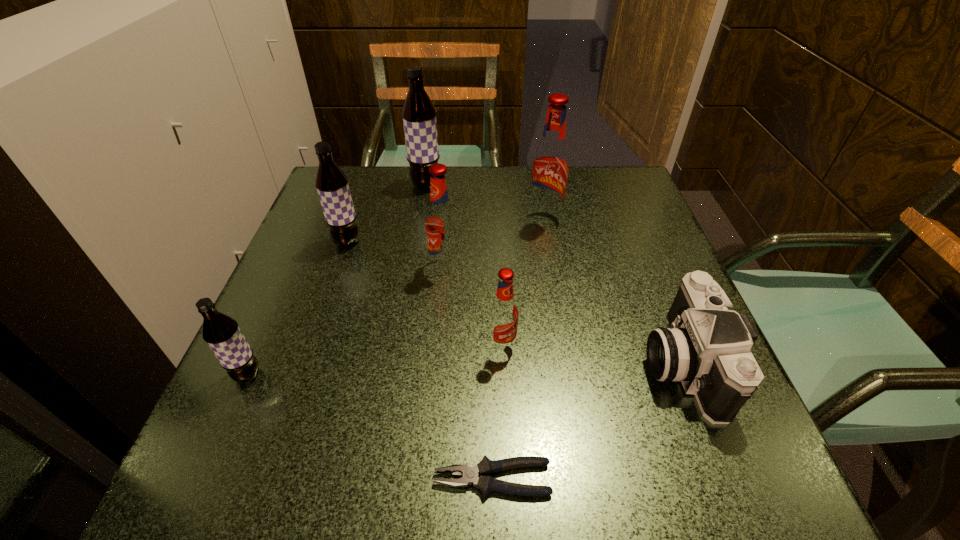
Locate an element on the screen. Image resolution: width=960 pixels, height=540 pixels. the biggest red root beer is located at coordinates (550, 166).

This screenshot has height=540, width=960. Identify the location of the farthest red root beer. (550, 166).

Identify the location of the farthest root beer. (419, 114).

Find the location of `the rightmost brown root beer`. the rightmost brown root beer is located at coordinates (419, 114).

You are a GUI agent. You are given a task and a screenshot of the screen. Output one action in this format:
    pyautogui.click(x=<x>, y=<y>)
    Task: Click on the fourth farthest root beer
    The image size is (960, 540).
    Given the screenshot: What is the action you would take?
    pyautogui.click(x=441, y=221)

Where is `the leftmost red root beer`? This screenshot has height=540, width=960. the leftmost red root beer is located at coordinates (441, 221).

Image resolution: width=960 pixels, height=540 pixels. Find the location of `the second root beer from left to right`. the second root beer from left to right is located at coordinates (332, 186).

Identify the location of the second brown root beer from left to right. This screenshot has width=960, height=540. (332, 186).

You are a GUI agent. You are given a task and a screenshot of the screen. Output one action in this format:
    pyautogui.click(x=<x>, y=<y>)
    Task: Click on the second red root beer from right to left
    Image resolution: width=960 pixels, height=540 pixels.
    Given the screenshot: What is the action you would take?
    pyautogui.click(x=503, y=314)

You are a GUI agent. You are given a task and a screenshot of the screen. Output one action in this format:
    pyautogui.click(x=<x>, y=<y>)
    Task: Click on the smallest red root beer
    Image resolution: width=960 pixels, height=540 pixels.
    Given the screenshot: What is the action you would take?
    pyautogui.click(x=503, y=314)